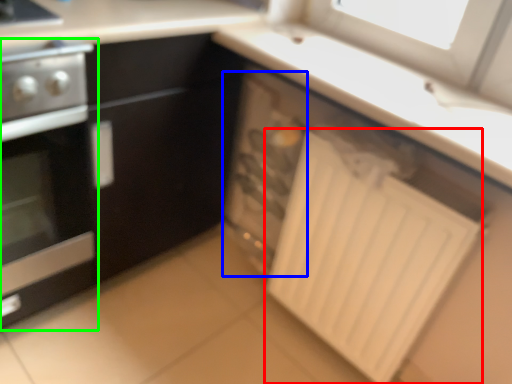
Question: Which object is the closest to the radiator (highlighted by a red box)? Choose among these: appliance (highlighted by a blue box) or home appliance (highlighted by a green box).

Choices:
 (A) appliance
 (B) home appliance

Answer: (A)